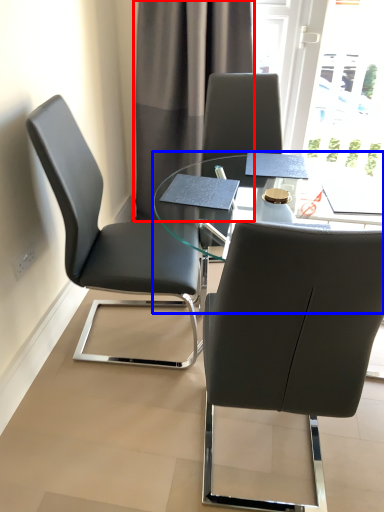
Question: Which object appears farthest to the camera in this image, curtain (highlighted by a red box) or table (highlighted by a blue box)?

Choices:
 (A) curtain
 (B) table

Answer: (A)